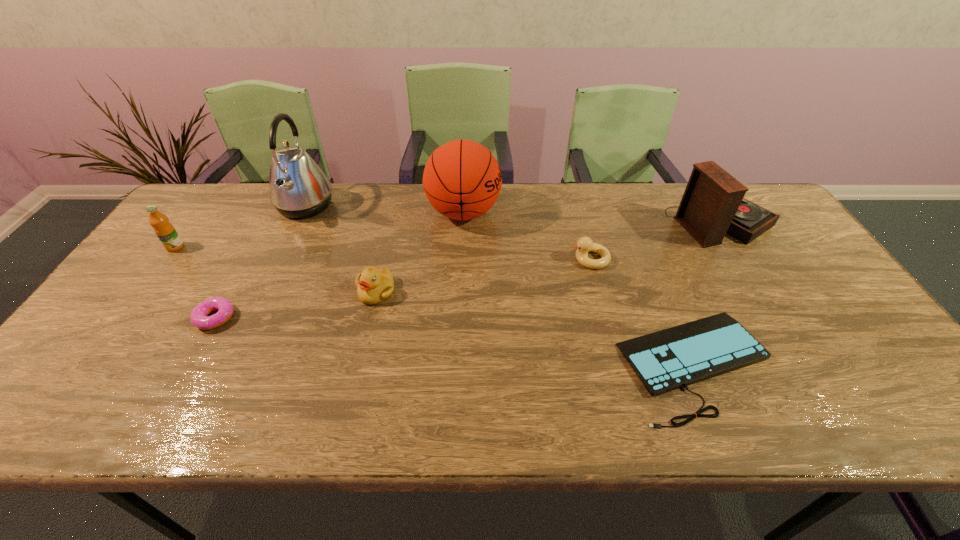
You are a GUI agent. You are given a task and a screenshot of the screen. Output one action in this format:
    pyautogui.click(x=<x>, y=<y>)
    Task: Click on the shortest object
    
    Given the screenshot: What is the action you would take?
    pyautogui.click(x=665, y=360)

Find the location of a particular element. free space located 0.380m from the spout of the kettle is located at coordinates (449, 206).

The height and width of the screenshot is (540, 960). Identify the location of vacant space located on the side with logo of the fourth object from right to left. (572, 213).

Find the location of a particular element. This screenshot has height=540, width=960. vacant space located on the front of the third tallest object is located at coordinates (753, 274).

In order to click on vacant space located 0.300m on the label of the leftmost object in this screenshot , I will do `click(110, 334)`.

Locate an element on the screen. This screenshot has width=960, height=540. vacant space situated 0.250m on the front-facing side of the nearer duckling is located at coordinates (353, 392).

Find the location of a particular element. This screenshot has height=540, width=960. free location located at the beak of the right duckling is located at coordinates (473, 259).

Identify the location of vacant space located at the beak of the right duckling. (435, 259).

Image resolution: width=960 pixels, height=540 pixels. Find the location of `free space located 0.100m at the beak of the right duckling`. free space located 0.100m at the beak of the right duckling is located at coordinates (536, 259).

Where is `free space located on the left of the doughnut`? The height and width of the screenshot is (540, 960). free space located on the left of the doughnut is located at coordinates (117, 318).